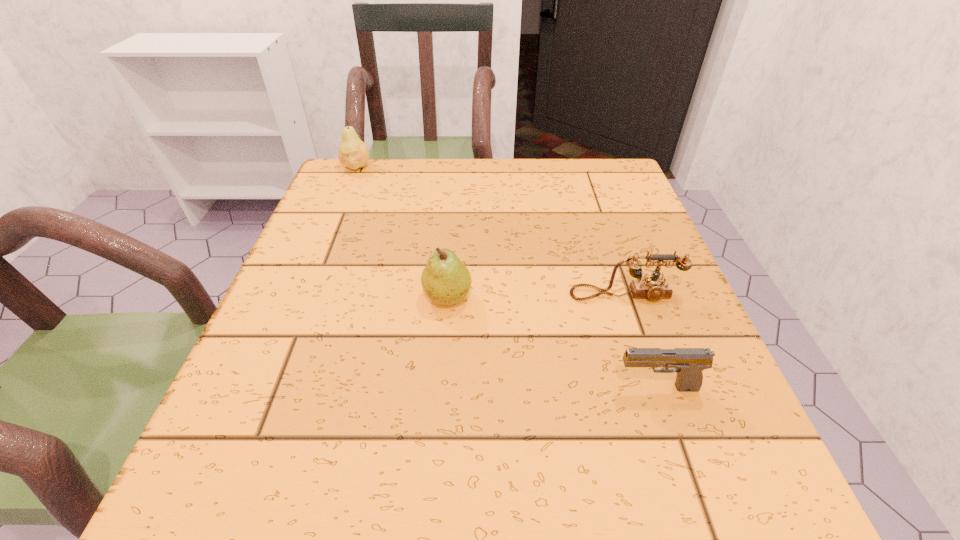
Identify the location of unoccupied position between the third object from right to left and the farther pear. (402, 232).

At what (x,y) coordinates should I click in order to perform the action: click on unoccupied area between the telephone and the right pear. Please return your answer as a coordinate pair (x, y). Looking at the image, I should click on (537, 296).

Identify the location of vacant area that lies between the nearer pear and the telephone. This screenshot has width=960, height=540. (537, 296).

Point out which object is positioned as the nearest to the leftmost object. Please provide its 2D coordinates. Your answer should be formatted as a tuple, i.e. [(x, y)], where the tuple contains the x and y coordinates of a point satisfying the conditions above.

[(445, 279)]

The image size is (960, 540). I want to click on object that can be found as the third closest to the pistol, so click(352, 152).

Identify the location of vacant point that satisfies the following two spatial constraints: 1. on the front side of the leftmost object; 2. on the left side of the nearer pear. [303, 296].